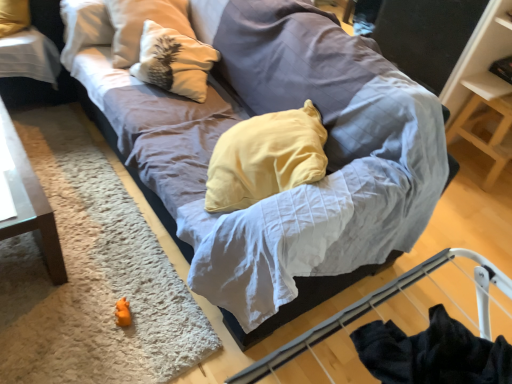
Question: From a real-world perspective, is orange plush toy at lower left beneath wooden shelf at upper right?

Choices:
 (A) no
 (B) yes

Answer: (B)

Question: Can you confirm if orange plush toy at lower left is thinner than wooden shelf at upper right?

Choices:
 (A) yes
 (B) no

Answer: (A)

Question: From the image's perspective, is orange plush toy at lower left located beneath wooden shelf at upper right?

Choices:
 (A) yes
 (B) no

Answer: (A)

Question: From a real-world perspective, does orange plush toy at lower left stand above wooden shelf at upper right?

Choices:
 (A) no
 (B) yes

Answer: (A)

Question: Does orange plush toy at lower left have a larger size compared to wooden shelf at upper right?

Choices:
 (A) no
 (B) yes

Answer: (A)

Question: Can you confirm if orange plush toy at lower left is smaller than wooden shelf at upper right?

Choices:
 (A) no
 (B) yes

Answer: (B)

Question: Is white textured pillow at upper left shorter than orange plush toy at lower left?

Choices:
 (A) yes
 (B) no

Answer: (B)

Question: Is white textured pillow at upper left at the left side of orange plush toy at lower left?

Choices:
 (A) no
 (B) yes

Answer: (B)

Question: Can you confirm if white textured pillow at upper left is positioned to the right of orange plush toy at lower left?

Choices:
 (A) yes
 (B) no

Answer: (B)

Question: Is white textured pillow at upper left facing away from orange plush toy at lower left?

Choices:
 (A) yes
 (B) no

Answer: (B)

Question: Does white textured pillow at upper left lie in front of orange plush toy at lower left?

Choices:
 (A) no
 (B) yes

Answer: (A)

Question: Can you confirm if white textured pillow at upper left is thinner than orange plush toy at lower left?

Choices:
 (A) yes
 (B) no

Answer: (B)

Question: Is white textured pillow at upper left bigger than wooden shelf at upper right?

Choices:
 (A) no
 (B) yes

Answer: (A)